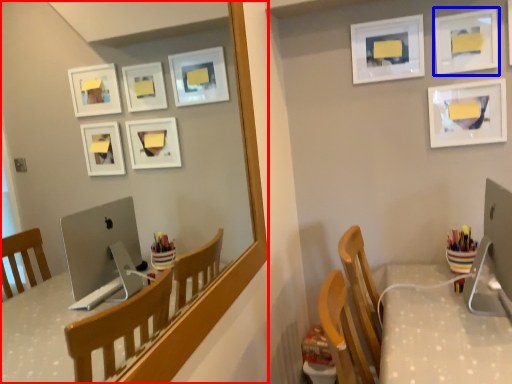
Question: Which object is closer to the camera taking this photo, mirror (highlighted by a red box) or picture frame (highlighted by a blue box)?

Choices:
 (A) mirror
 (B) picture frame

Answer: (A)